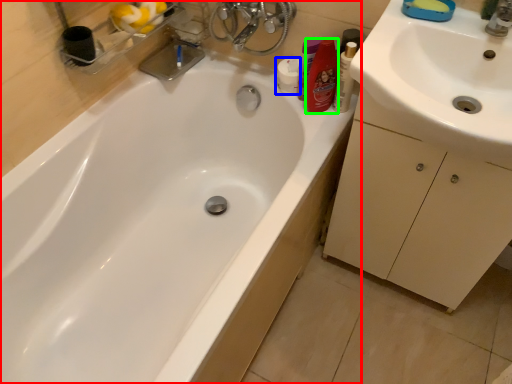
Question: Which is farther away from bathtub (highlighted by a red box)? toiletry (highlighted by a blue box) or toiletry (highlighted by a green box)?

Choices:
 (A) toiletry
 (B) toiletry

Answer: (A)